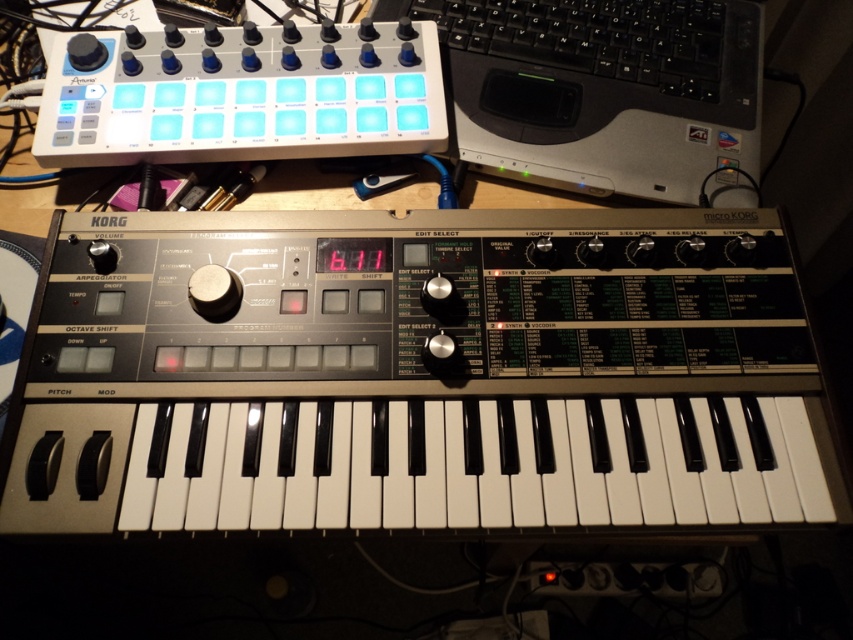
You are a music producer setting up your studio. You need to place a stand for the metallic silver piano at center and the black plastic keyboard at upper right. Since the stand has limited vertical space, which object should be placed lower to ensure both fit?

The black plastic keyboard at upper right should be placed lower because the metallic silver piano at center is taller and requires more vertical space.